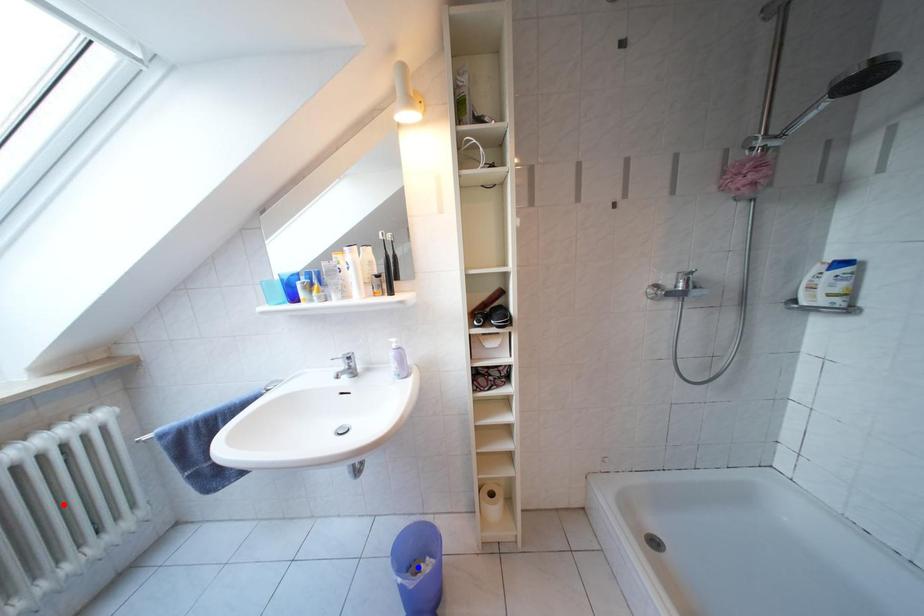
Question: In the image, two points are highlighted. Which point is nearer to the camera? Reply with the corresponding letter.

Choices:
 (A) blue point
 (B) red point

Answer: (B)